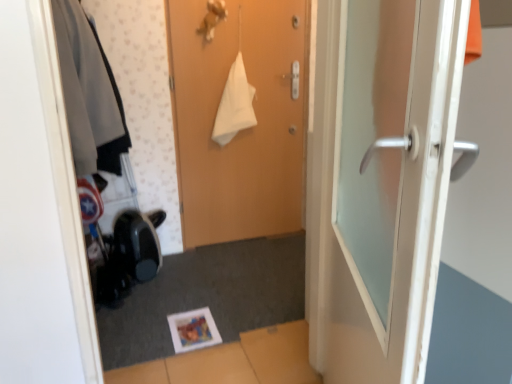
Where is `vacant region in front of wooden door at center, which is counted as the 2th door, starting from the front`? The height and width of the screenshot is (384, 512). vacant region in front of wooden door at center, which is counted as the 2th door, starting from the front is located at coordinates (240, 266).